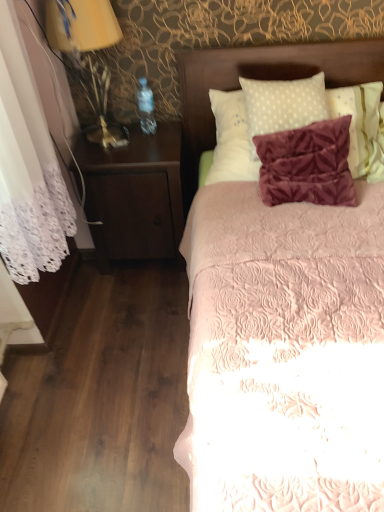
Question: Is matte gold lamp at left located within velvet brown headboard at upper center?

Choices:
 (A) no
 (B) yes

Answer: (A)

Question: From the image's perspective, is velvet brown headboard at upper center over matte gold lamp at left?

Choices:
 (A) no
 (B) yes

Answer: (A)

Question: Is velvet brown headboard at upper center looking in the opposite direction of matte gold lamp at left?

Choices:
 (A) yes
 (B) no

Answer: (B)

Question: Is velvet brown headboard at upper center at the left side of matte gold lamp at left?

Choices:
 (A) no
 (B) yes

Answer: (A)

Question: Is velvet brown headboard at upper center bigger than matte gold lamp at left?

Choices:
 (A) yes
 (B) no

Answer: (A)

Question: Considering the relative sizes of velvet brown headboard at upper center and matte gold lamp at left in the image provided, is velvet brown headboard at upper center taller than matte gold lamp at left?

Choices:
 (A) no
 (B) yes

Answer: (A)

Question: Does velvet brown headboard at upper center lie in front of pink quilted bed at center?

Choices:
 (A) no
 (B) yes

Answer: (A)

Question: From the image's perspective, is velvet brown headboard at upper center located beneath pink quilted bed at center?

Choices:
 (A) no
 (B) yes

Answer: (A)

Question: Is velvet brown headboard at upper center thinner than pink quilted bed at center?

Choices:
 (A) no
 (B) yes

Answer: (B)

Question: Does velvet brown headboard at upper center have a smaller size compared to pink quilted bed at center?

Choices:
 (A) no
 (B) yes

Answer: (B)

Question: From the image's perspective, is velvet brown headboard at upper center located above pink quilted bed at center?

Choices:
 (A) no
 (B) yes

Answer: (B)

Question: Is velvet brown headboard at upper center to the right of pink quilted bed at center from the viewer's perspective?

Choices:
 (A) yes
 (B) no

Answer: (B)

Question: Is matte gold lamp at left oriented towards dark wood nightstand at left?

Choices:
 (A) yes
 (B) no

Answer: (B)